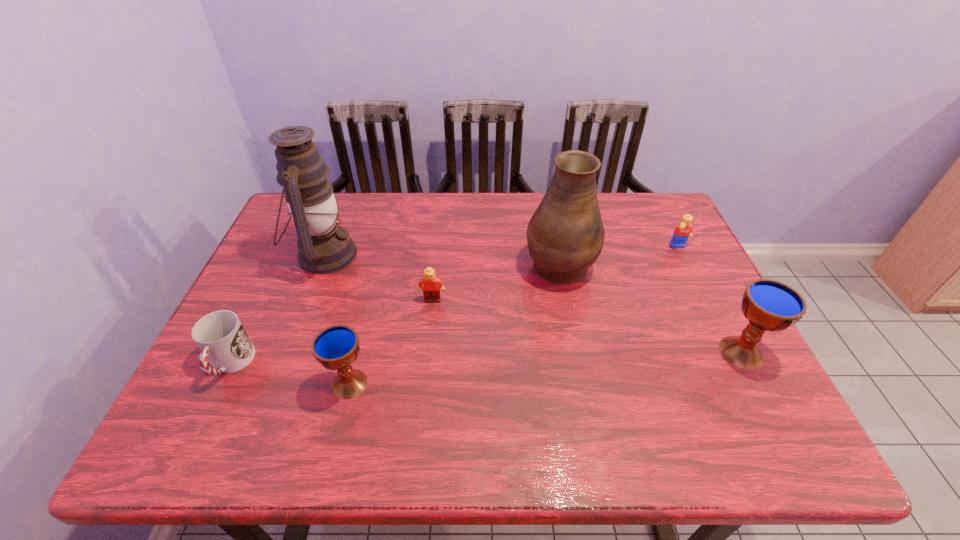
To make them evenly spaced by inserting another chalice among them, please locate a free space for this new chalice. Please provide its 2D coordinates. Your answer should be formatted as a tuple, i.e. [(x, y)], where the tuple contains the x and y coordinates of a point satisfying the conditions above.

[(551, 367)]